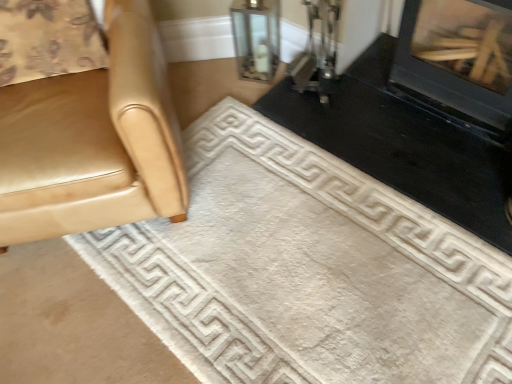
Question: From their relative heights in the image, would you say matte gold chair at left is taller or shorter than white soft rug at center?

Choices:
 (A) short
 (B) tall

Answer: (B)

Question: From a real-world perspective, is matte gold chair at left above or below white soft rug at center?

Choices:
 (A) below
 (B) above

Answer: (B)

Question: Which object is the closest to the black glossy fireplace at upper right, marked as the 1th fireplace in a left-to-right arrangement?

Choices:
 (A) white soft rug at center
 (B) black glass fireplace at upper right, the second fireplace positioned from the left
 (C) clear glass vase at upper center
 (D) matte gold chair at left

Answer: (B)

Question: Estimate the real-world distances between objects in this image. Which object is farther from the black glass fireplace at upper right, the first fireplace from the right?

Choices:
 (A) black glossy fireplace at upper right, the 2th fireplace in the right-to-left sequence
 (B) white soft rug at center
 (C) clear glass vase at upper center
 (D) matte gold chair at left

Answer: (D)